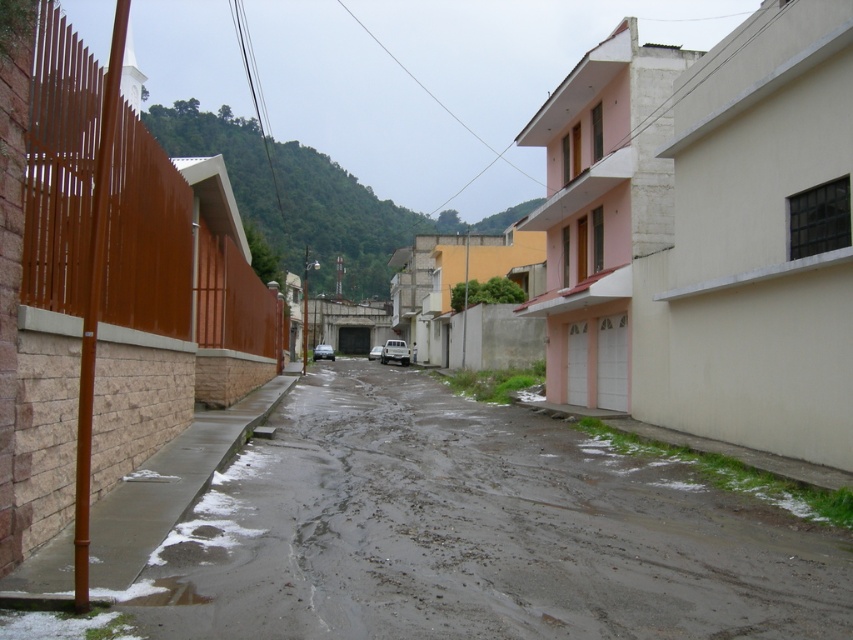
Question: Which point is farther from the camera taking this photo?

Choices:
 (A) (315, 348)
 (B) (328, 250)
 (C) (206, 636)

Answer: (B)

Question: Estimate the real-world distances between objects in this image. Which object is farther from the metallic silver car at center?

Choices:
 (A) white matte car at center
 (B) gray concrete mud at center

Answer: (B)

Question: Is white matte van at center to the left of white matte car at center from the viewer's perspective?

Choices:
 (A) yes
 (B) no

Answer: (B)

Question: Is green leafy hillside at upper center in front of metallic silver car at center?

Choices:
 (A) yes
 (B) no

Answer: (A)

Question: Based on their relative distances, which object is nearer to the metallic silver car at center?

Choices:
 (A) white matte car at center
 (B) green leafy hillside at upper center
 (C) white matte van at center

Answer: (A)

Question: Does gray concrete mud at center have a greater width compared to metallic silver car at center?

Choices:
 (A) yes
 (B) no

Answer: (A)